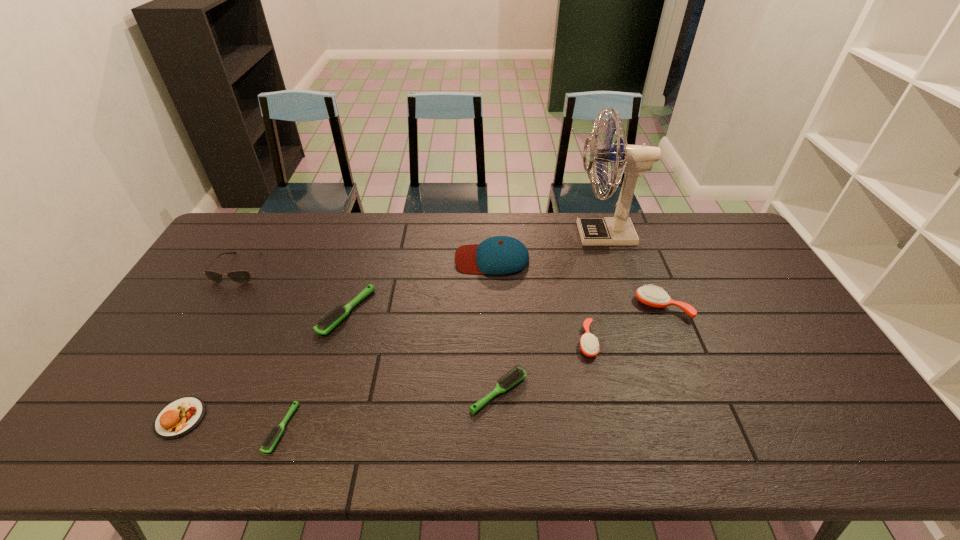
Identify the location of the tallest object. Image resolution: width=960 pixels, height=540 pixels. (633, 160).

Locate an element on the screen. This screenshot has width=960, height=540. blue fan is located at coordinates (633, 160).

At what (x,y) coordinates should I click in order to perform the action: click on baseball cap. Please return your answer as a coordinate pair (x, y). Image resolution: width=960 pixels, height=540 pixels. Looking at the image, I should click on (499, 255).

Where is `sunglasses`? The image size is (960, 540). sunglasses is located at coordinates click(242, 276).

Image resolution: width=960 pixels, height=540 pixels. I want to click on the farther orange hairbrush, so click(x=651, y=296).

Locate an element on the screen. The height and width of the screenshot is (540, 960). the tallest hairbrush is located at coordinates (651, 296).

Image resolution: width=960 pixels, height=540 pixels. I want to click on the farthest light hairbrush, so click(329, 320).

At what (x,y) coordinates should I click in order to perform the action: click on the seventh object from left to right. Please return your answer as a coordinate pair (x, y). This screenshot has height=540, width=960. Looking at the image, I should click on (589, 344).

This screenshot has height=540, width=960. In order to click on the smaller orange hairbrush in this screenshot , I will do `click(589, 344)`.

Locate an element on the screen. The width and height of the screenshot is (960, 540). patty (food) is located at coordinates (179, 417).